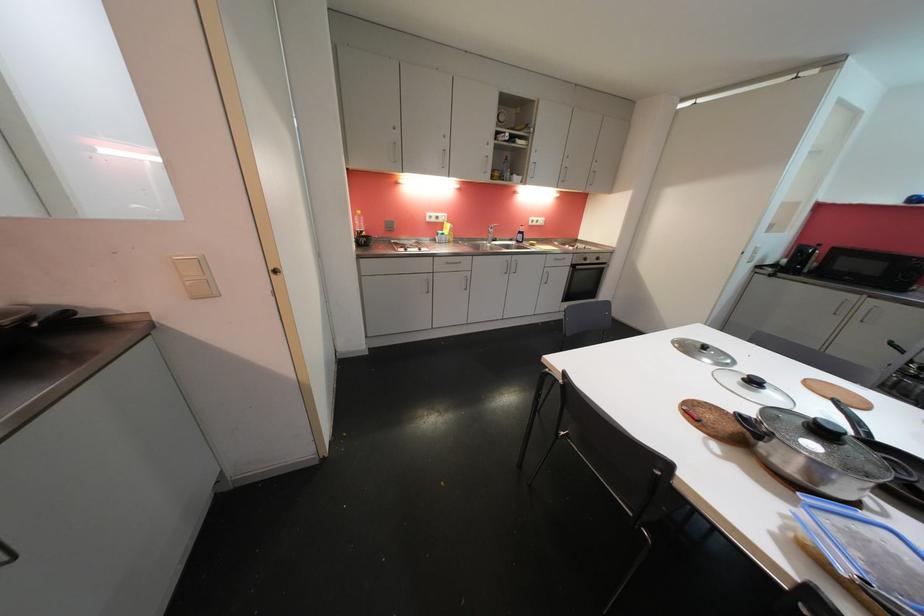
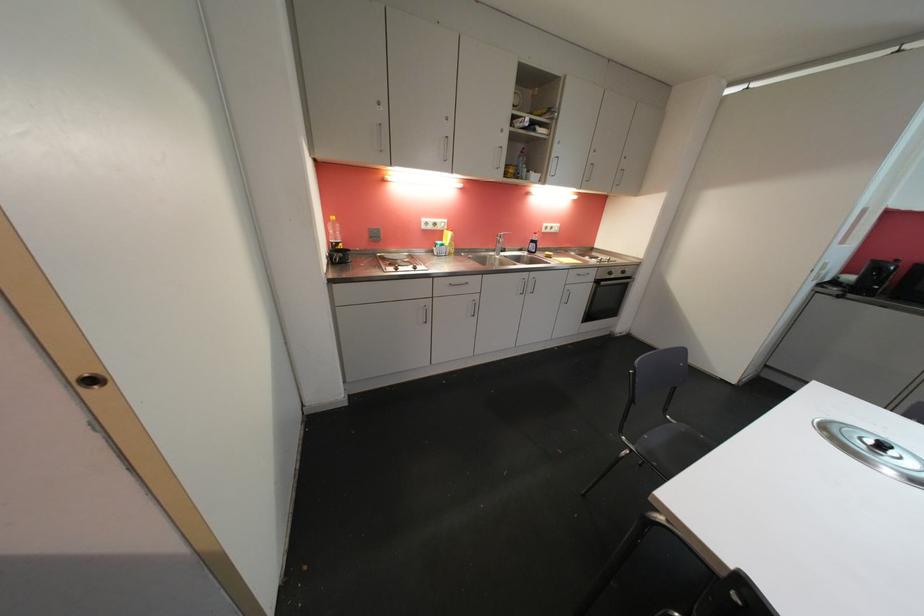
Question: The camera is either moving clockwise (left) or counter-clockwise (right) around the object. The first image is from the beginning of the video and the second image is from the end. Is the camera moving left or right when shooting the video?

Choices:
 (A) Left
 (B) Right

Answer: (A)